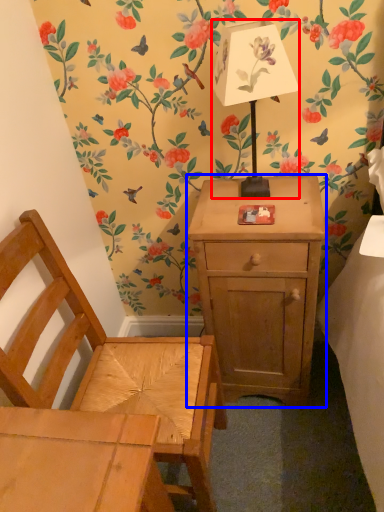
Question: Which point is closer to the camera, table lamp (highlighted by a red box) or nightstand (highlighted by a blue box)?

Choices:
 (A) table lamp
 (B) nightstand

Answer: (A)